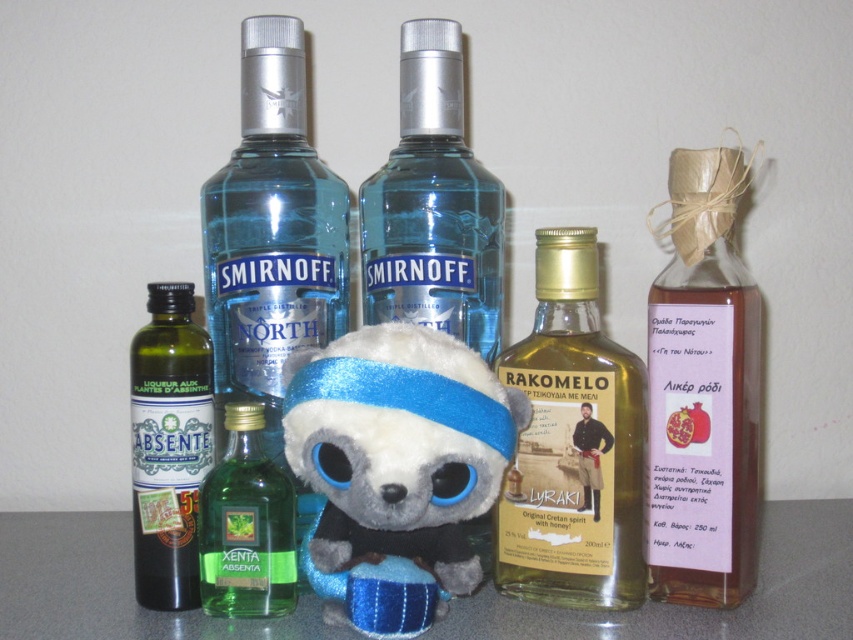
You are a bartender who needs to place a 10 inch long cocktail shaker between the transparent glass smirnoff north vodka at center and the green glass bottle at center. Can you fit the cocktail shaker between them?

The transparent glass smirnoff north vodka at center and the green glass bottle at center are 8.63 inches apart from each other. Since the cocktail shaker is 10 inches long, it cannot fit between them as the space is smaller than the shaker.

Which object is located at the coordinate point (703, 392)?

The point (703, 392) corresponds to the translucent paper wrapped bottle at right.

You are trying to fit both the translucent paper wrapped bottle at right and the green glass bottle at center into a narrow shelf. Based on their widths, which one might have a better chance of fitting through the narrow space first?

The green glass bottle at center might have a better chance of fitting through the narrow space first since it is likely narrower than the translucent paper wrapped bottle at right, which might be wider according to the description.